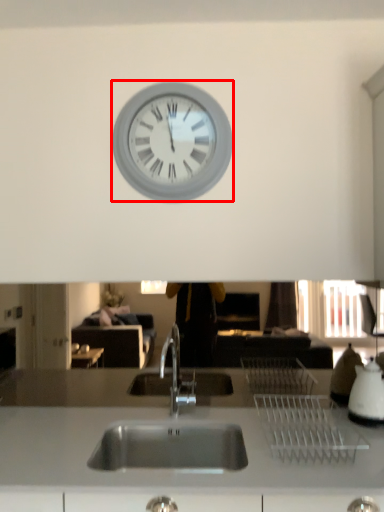
Question: From the image's perspective, what is the correct spatial relationship of wall clock (annotated by the red box) in relation to appliance?

Choices:
 (A) above
 (B) below

Answer: (A)